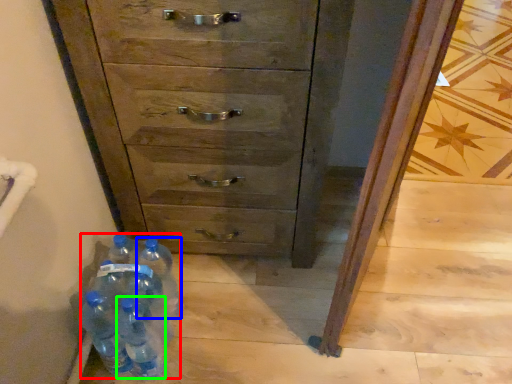
Question: Which object is the farthest from bottle (highlighted by a red box)? Choose among these: bottle (highlighted by a blue box) or bottle (highlighted by a green box).

Choices:
 (A) bottle
 (B) bottle

Answer: (A)